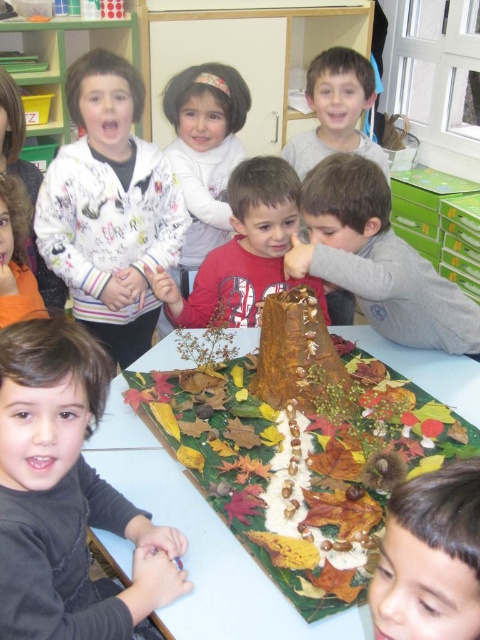
Is brown textured sweater at lower left to the left of smooth brown tree trunk at center from the viewer's perspective?

Indeed, brown textured sweater at lower left is positioned on the left side of smooth brown tree trunk at center.

Between point (27, 369) and point (381, 209), which one is positioned in front?

Point (27, 369)

Locate an element on the screen. This screenshot has width=480, height=640. brown textured sweater at lower left is located at coordinates (66, 493).

The image size is (480, 640). In order to click on brown textured sweater at lower left in this screenshot , I will do `click(66, 493)`.

Is brown hair at lower right shorter than white fluffy sweater at center?

Yes.

Consider the image. Does brown hair at lower right appear under white fluffy sweater at center?

Yes, brown hair at lower right is below white fluffy sweater at center.

Is point (418, 492) in front of point (220, 189)?

Yes.

Locate an element on the screen. brown hair at lower right is located at coordinates (430, 557).

At what (x,y) coordinates should I click in order to perform the action: click on brown textured sweater at lower left. Please return your answer as a coordinate pair (x, y). The width and height of the screenshot is (480, 640). Looking at the image, I should click on pyautogui.click(x=66, y=493).

Image resolution: width=480 pixels, height=640 pixels. What do you see at coordinates (66, 493) in the screenshot? I see `brown textured sweater at lower left` at bounding box center [66, 493].

Describe the element at coordinates (66, 493) in the screenshot. The width and height of the screenshot is (480, 640). I see `brown textured sweater at lower left` at that location.

The image size is (480, 640). Identify the location of brown textured sweater at lower left. (66, 493).